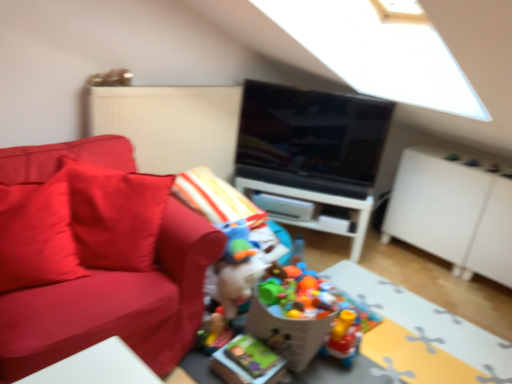
Question: Does plastic colorful toys at center, which is counted as the 3th toy, starting from the front, have a lesser width compared to cardboard box at center, arranged as the 2th table when viewed from the top?

Choices:
 (A) yes
 (B) no

Answer: (A)

Question: From a real-world perspective, is plastic colorful toys at center, which is counted as the 3th toy, starting from the front, located beneath cardboard box at center, arranged as the 2th table when viewed from the top?

Choices:
 (A) yes
 (B) no

Answer: (B)

Question: Is plastic colorful toys at center, which is counted as the 3th toy, starting from the front, shorter than cardboard box at center, arranged as the 2th table when viewed from the top?

Choices:
 (A) yes
 (B) no

Answer: (B)

Question: Is plastic colorful toys at center, arranged as the 1th toy when viewed from the back, further to the viewer compared to cardboard box at center, marked as the first table in a front-to-back arrangement?

Choices:
 (A) yes
 (B) no

Answer: (A)

Question: Can you confirm if plastic colorful toys at center, which is counted as the 3th toy, starting from the front, is wider than cardboard box at center, the 2th table from the back?

Choices:
 (A) yes
 (B) no

Answer: (B)

Question: Choose the correct answer: Is matte red couch at left inside white matte dresser at right or outside it?

Choices:
 (A) outside
 (B) inside

Answer: (A)

Question: Does point (181, 284) appear closer or farther from the camera than point (431, 205)?

Choices:
 (A) closer
 (B) farther

Answer: (A)

Question: From a real-world perspective, is matte red couch at left physically located above or below white matte dresser at right?

Choices:
 (A) below
 (B) above

Answer: (B)

Question: In terms of size, does matte red couch at left appear bigger or smaller than white matte dresser at right?

Choices:
 (A) big
 (B) small

Answer: (A)

Question: Looking at the image, does plastic colorful toys at center, arranged as the 1th toy when viewed from the back, seem bigger or smaller compared to matte red couch at left?

Choices:
 (A) small
 (B) big

Answer: (A)

Question: Is plastic colorful toys at center, arranged as the 1th toy when viewed from the back, wider or thinner than matte red couch at left?

Choices:
 (A) thin
 (B) wide

Answer: (A)

Question: From a real-world perspective, is plastic colorful toys at center, arranged as the 1th toy when viewed from the back, physically located above or below matte red couch at left?

Choices:
 (A) below
 (B) above

Answer: (A)

Question: From their relative heights in the image, would you say plastic colorful toys at center, arranged as the 1th toy when viewed from the back, is taller or shorter than matte red couch at left?

Choices:
 (A) tall
 (B) short

Answer: (B)

Question: In terms of size, does translucent plastic toy at center, arranged as the second toy when viewed from the front, appear bigger or smaller than matte red pillow at left?

Choices:
 (A) big
 (B) small

Answer: (B)

Question: Considering the positions of translucent plastic toy at center, arranged as the second toy when viewed from the front, and matte red pillow at left in the image, is translucent plastic toy at center, arranged as the second toy when viewed from the front, wider or thinner than matte red pillow at left?

Choices:
 (A) thin
 (B) wide

Answer: (A)